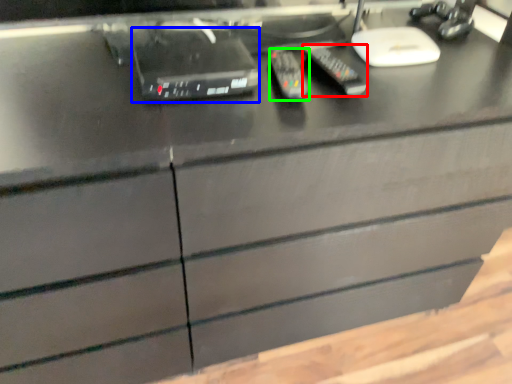
Question: Based on their relative distances, which object is farther from control (highlighted by a red box)? Choose from equipment (highlighted by a blue box) and control (highlighted by a green box).

Choices:
 (A) equipment
 (B) control

Answer: (A)